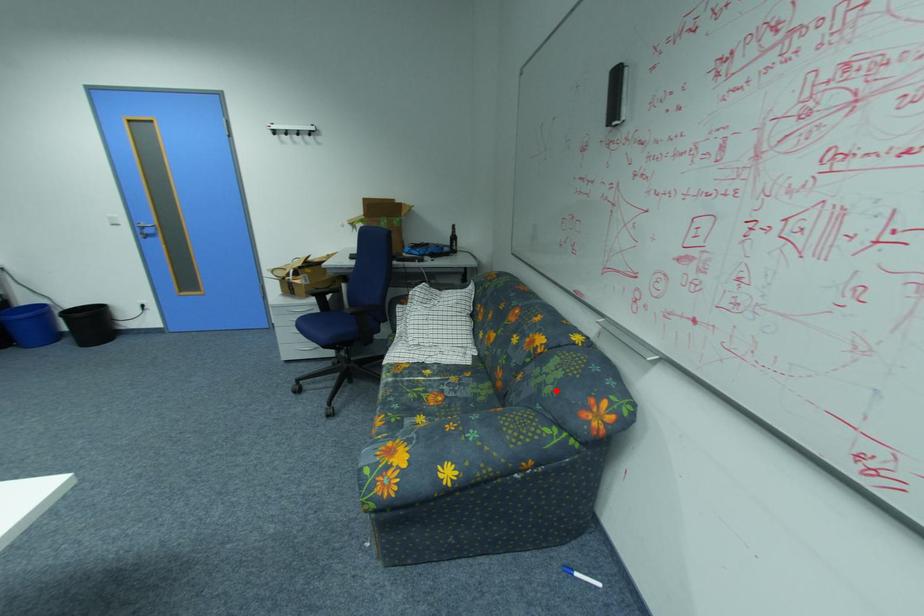
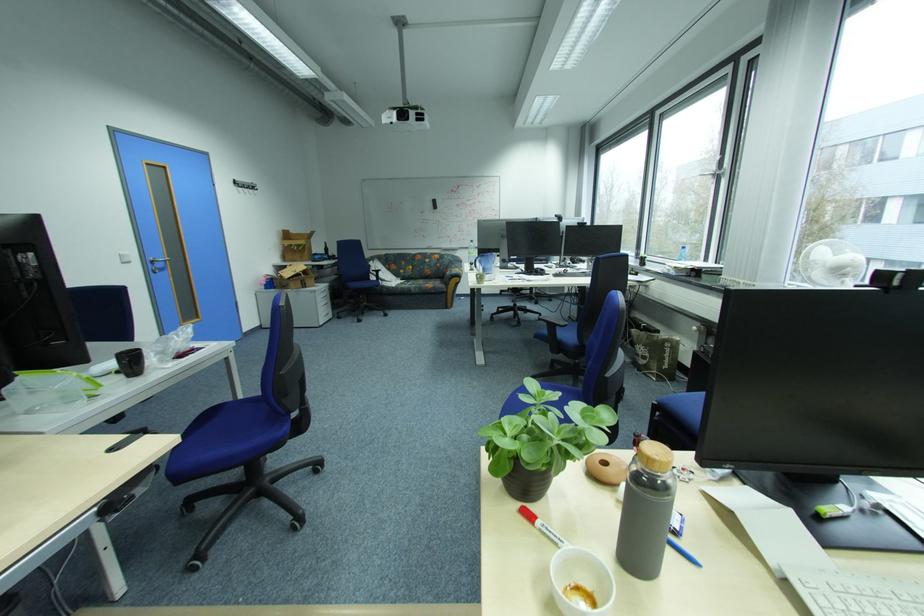
In the second image, find the point that corresponds to the highlighted location in the first image.

(460, 261)